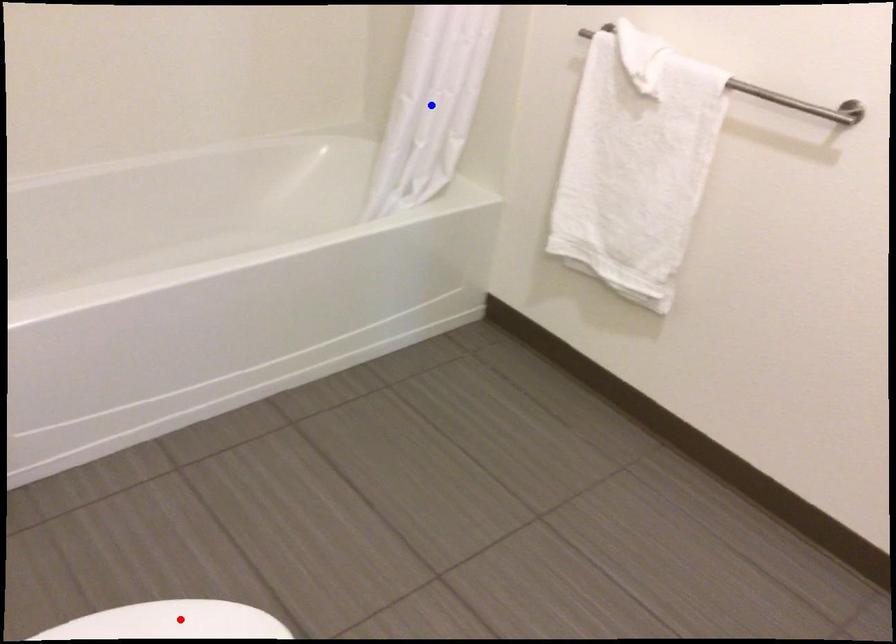
Question: Two points are marked on the image. Which point is closer to the camera?

Choices:
 (A) Blue point is closer.
 (B) Red point is closer.

Answer: (B)